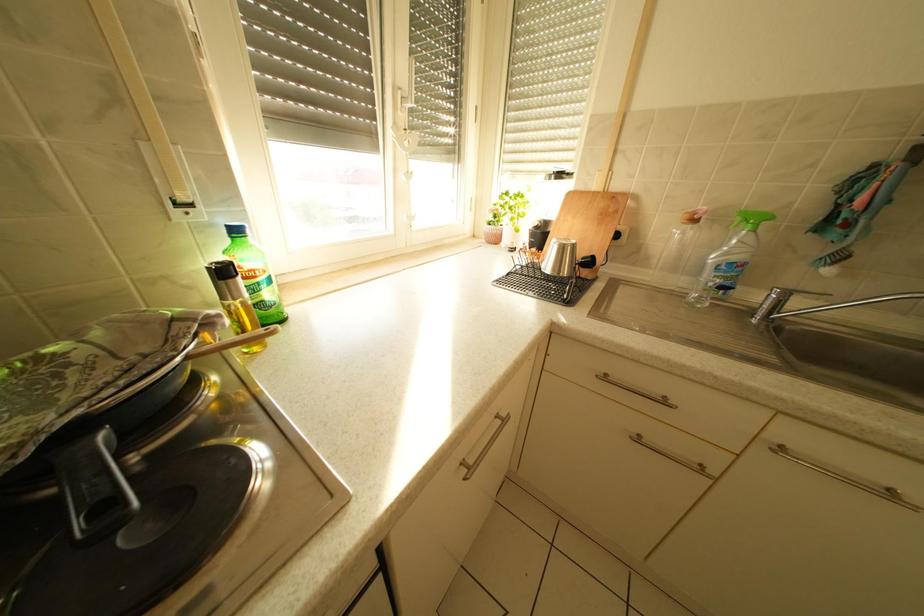
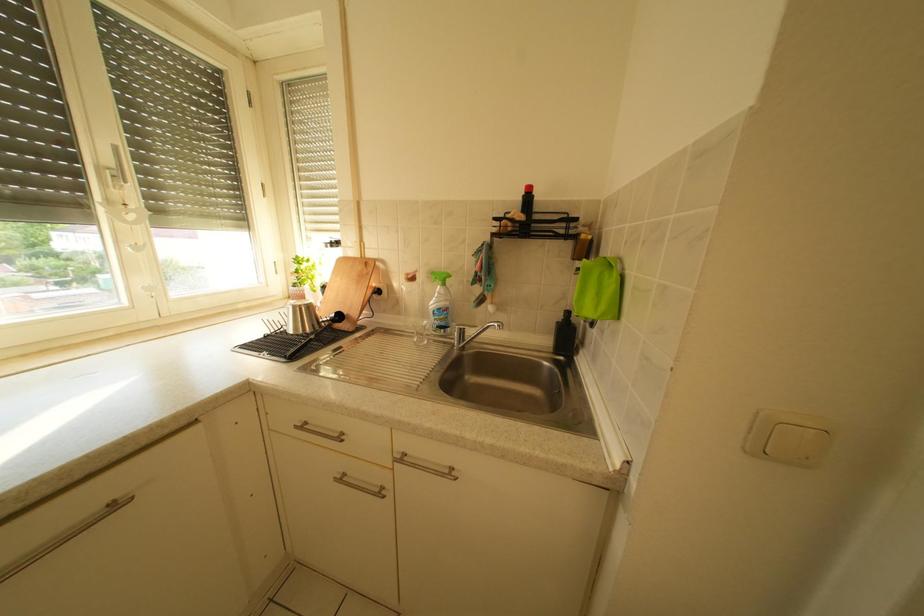
Question: What movement of the cameraman would produce the second image?

Choices:
 (A) Left
 (B) Right
 (C) Forward
 (D) Backward

Answer: (B)